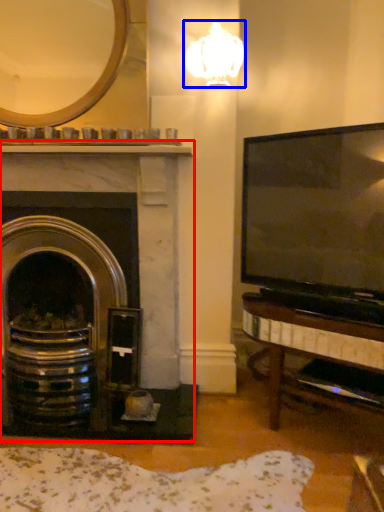
Question: Among these objects, which one is farthest to the camera, fireplace (highlighted by a red box) or lamp (highlighted by a blue box)?

Choices:
 (A) fireplace
 (B) lamp

Answer: (A)